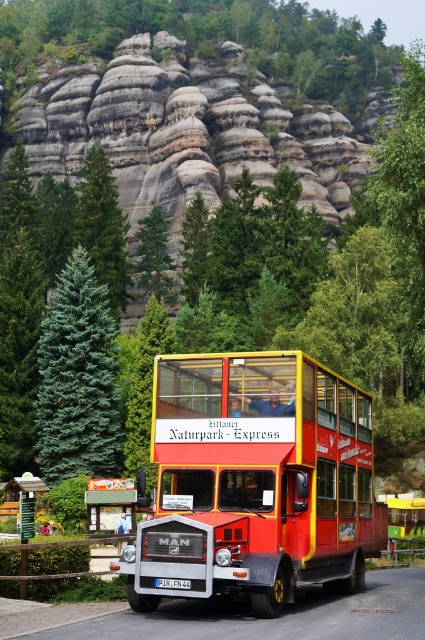
You are standing at the point marked by the coordinates (x=78, y=378) in the image. What do you see directly in front of you?

The point marked by the coordinates (x=78, y=378) indicates a blue green coniferous tree at left, so you would see the blue green coniferous tree directly in front of you.